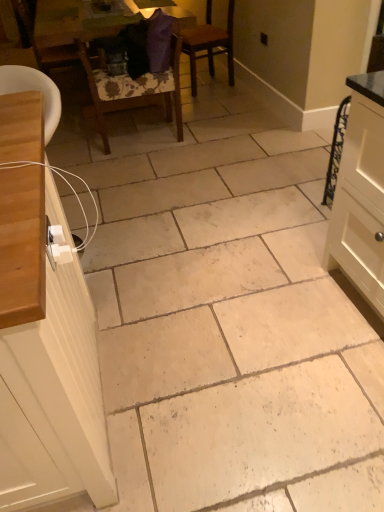
At what (x,y) coordinates should I click in order to perform the action: click on free spot behind white matte cabinet at left. Please return your answer as a coordinate pair (x, y). Looking at the image, I should click on (143, 250).